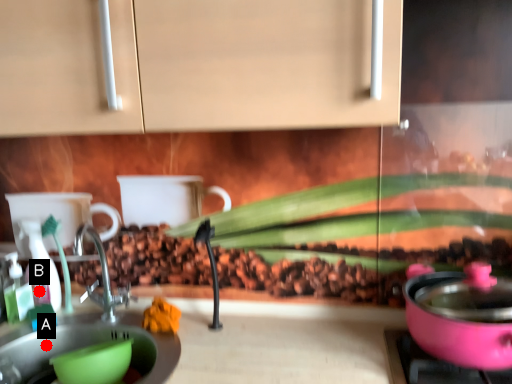
Question: Two points are circled on the image, labeled by A and B beside each circle. Which point is farther from the camera taking this photo?

Choices:
 (A) A is further
 (B) B is further

Answer: (B)